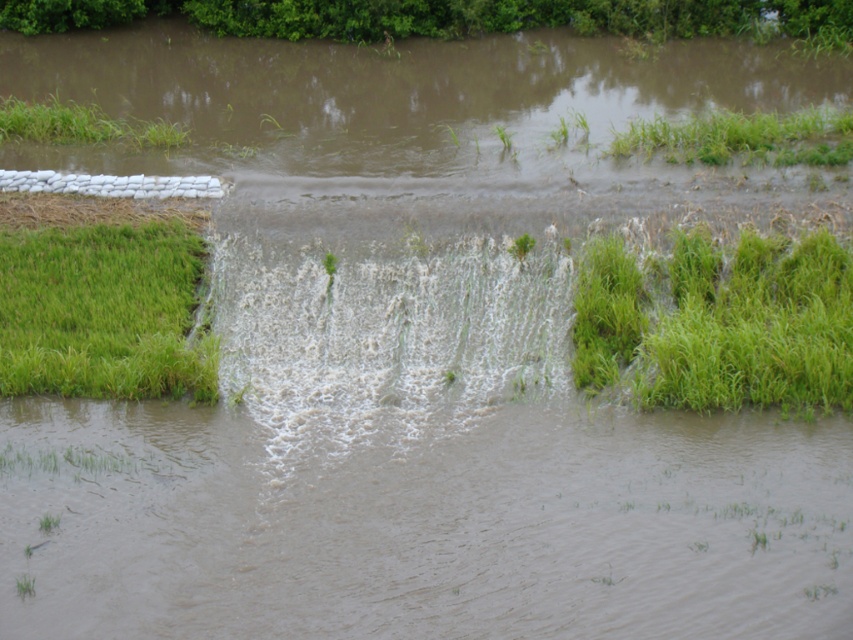
Question: Which of the following is the closest to the observer?

Choices:
 (A) green grass at upper left
 (B) green matte grass at center

Answer: (B)

Question: Which point is farther from the camera taking this photo?

Choices:
 (A) (132, 132)
 (B) (154, 328)

Answer: (A)

Question: Is green soft grass at lower left thinner than green grass at upper left?

Choices:
 (A) yes
 (B) no

Answer: (A)

Question: Does green grass at upper left have a lesser width compared to green matte grass at center?

Choices:
 (A) no
 (B) yes

Answer: (A)

Question: Is green soft grass at lower left above green grass at upper left?

Choices:
 (A) no
 (B) yes

Answer: (A)

Question: Which point appears closest to the camera in this image?

Choices:
 (A) (111, 392)
 (B) (608, 257)
 (C) (30, 131)
 (D) (799, 136)

Answer: (A)